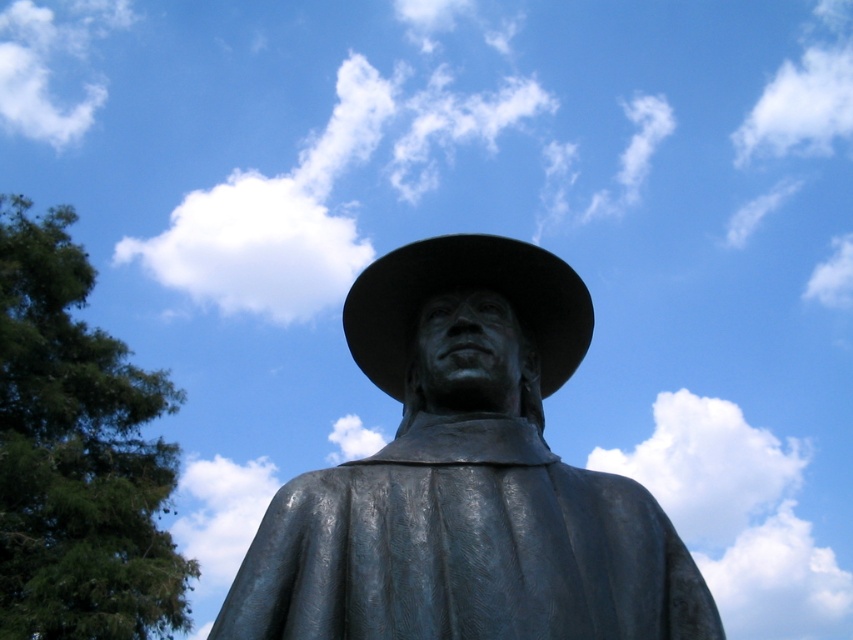
Between white fluffy cloud at upper center and shiny black cowboy hat at center, which one has more height?

white fluffy cloud at upper center

Who is more forward, (305, 317) or (402, 348)?

Point (402, 348) is more forward.

Locate an element on the screen. white fluffy cloud at upper center is located at coordinates (256, 244).

Is shiny black cowboy hat at center above white fluffy cloud at upper left?

No, shiny black cowboy hat at center is not above white fluffy cloud at upper left.

Who is taller, shiny black cowboy hat at center or white fluffy cloud at upper left?

white fluffy cloud at upper left is taller.

Does point (494, 269) come behind point (1, 83)?

No, (494, 269) is in front of (1, 83).

Find the location of a particular element. shiny black cowboy hat at center is located at coordinates (462, 289).

Which is more to the right, bronze statue at center or shiny black cowboy hat at center?

Positioned to the right is shiny black cowboy hat at center.

Does bronze statue at center appear over shiny black cowboy hat at center?

No.

Between point (231, 627) and point (398, 384), which one is positioned behind?

Positioned behind is point (398, 384).

Find the location of a particular element. The width and height of the screenshot is (853, 640). bronze statue at center is located at coordinates (466, 477).